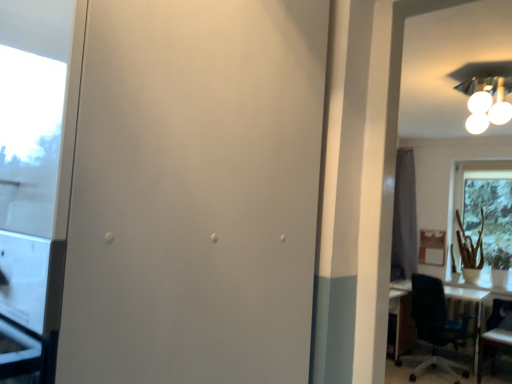
Question: Is white matte screen door at center wider than black plastic chair at right, the first chair when ordered from left to right?

Choices:
 (A) no
 (B) yes

Answer: (A)

Question: Is white matte screen door at center completely or partially outside of black plastic chair at right, the first chair when ordered from left to right?

Choices:
 (A) no
 (B) yes

Answer: (B)

Question: Is white matte screen door at center behind black plastic chair at right, the first chair when ordered from left to right?

Choices:
 (A) yes
 (B) no

Answer: (B)

Question: Is white matte screen door at center beside black plastic chair at right, the second chair when ordered from right to left?

Choices:
 (A) no
 (B) yes

Answer: (A)

Question: Is white matte screen door at center to the right of black plastic chair at right, the first chair when ordered from left to right, from the viewer's perspective?

Choices:
 (A) yes
 (B) no

Answer: (B)

Question: From a real-world perspective, is white matte screen door at center under black plastic chair at right, the second chair when ordered from right to left?

Choices:
 (A) no
 (B) yes

Answer: (A)

Question: Can you confirm if wooden chair at right, the first chair positioned from the right, is wider than transparent glass window at right?

Choices:
 (A) no
 (B) yes

Answer: (B)

Question: Does wooden chair at right, the first chair positioned from the right, come behind transparent glass window at right?

Choices:
 (A) no
 (B) yes

Answer: (A)

Question: Can you confirm if wooden chair at right, arranged as the second chair when viewed from the left, is shorter than transparent glass window at right?

Choices:
 (A) no
 (B) yes

Answer: (B)

Question: Does wooden chair at right, arranged as the second chair when viewed from the left, turn towards transparent glass window at right?

Choices:
 (A) yes
 (B) no

Answer: (B)

Question: Is wooden chair at right, arranged as the second chair when viewed from the left, positioned far away from transparent glass window at right?

Choices:
 (A) no
 (B) yes

Answer: (B)

Question: Considering the relative sizes of wooden chair at right, arranged as the second chair when viewed from the left, and transparent glass window at right in the image provided, is wooden chair at right, arranged as the second chair when viewed from the left, bigger than transparent glass window at right?

Choices:
 (A) yes
 (B) no

Answer: (B)

Question: Does transparent glass window at right have a smaller size compared to black plastic chair at right, the first chair when ordered from left to right?

Choices:
 (A) no
 (B) yes

Answer: (B)